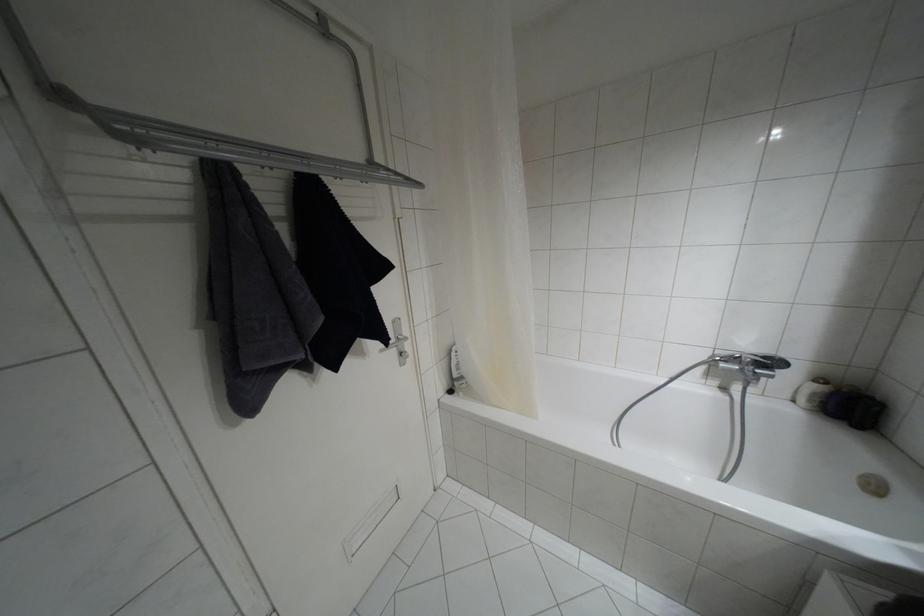
Image resolution: width=924 pixels, height=616 pixels. Identify the location of faucet lever. (758, 360).